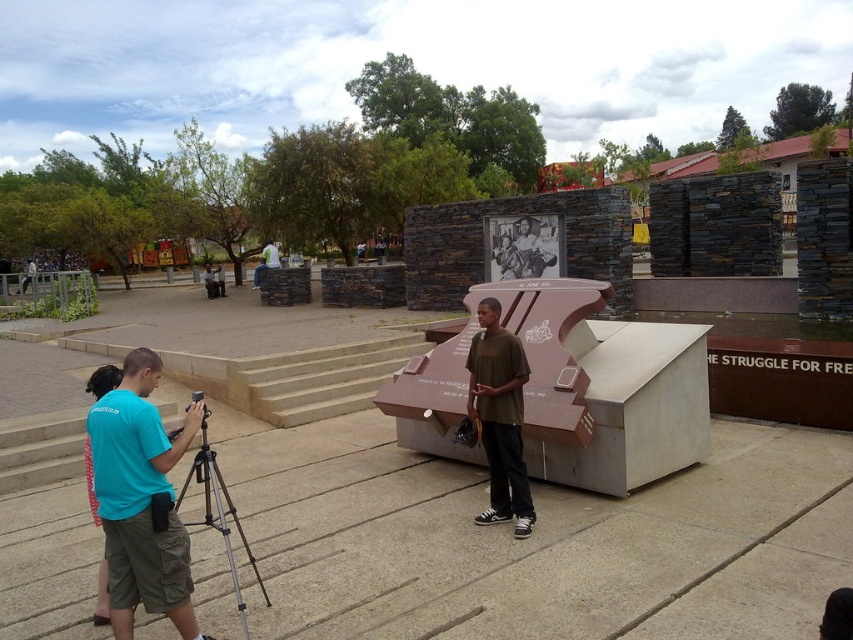
You are standing at the entrance of the memorial site and want to take a photo of the large sculpture. The person in the teal fabric shirt at center is blocking your view. Can you move to the left or right to avoid them?

The teal fabric shirt at center is located at point (141, 499). Since the coordinates are relative to the image, moving either left or right might help avoid the obstruction, but specific direction depends on the exact positioning within the scene.

Consider the image. You are a photographer trying to capture a clear shot of the matte brown shirt at center and the silver metallic tripod at lower left. Which object should you focus on first if you want to ensure both are in focus?

The matte brown shirt at center is further to the viewer than the silver metallic tripod at lower left, so you should focus on the matte brown shirt at center first to ensure both are in focus.